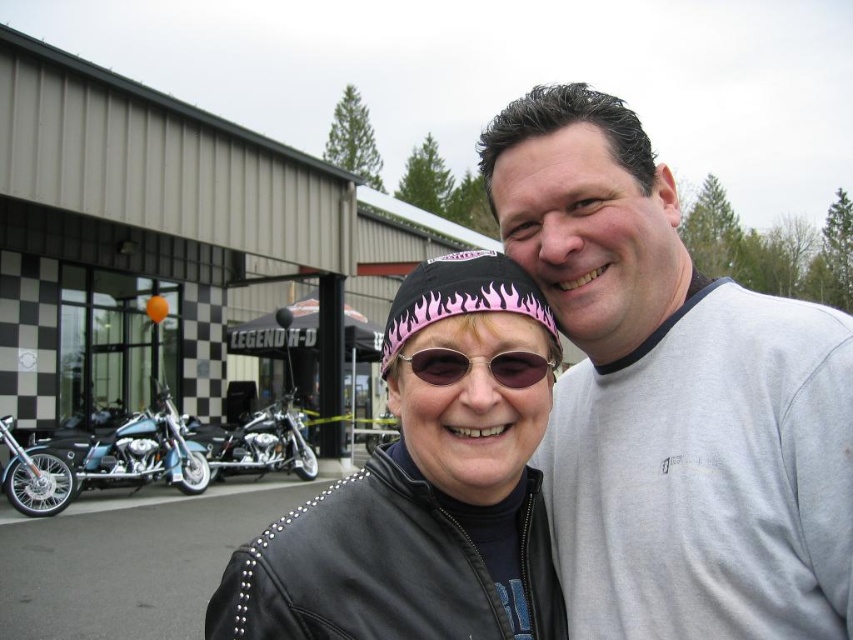
Question: Does black leather jacket at center have a smaller size compared to teal metallic motorcycle at left?

Choices:
 (A) yes
 (B) no

Answer: (A)

Question: Which point is farther to the camera?

Choices:
 (A) teal metallic motorcycle at left
 (B) gray cotton t-shirt at upper right
 (C) pink fabric headscarf at center

Answer: (A)

Question: Can you confirm if black leather jacket at center is positioned to the left of polished chrome wheel at lower left?

Choices:
 (A) no
 (B) yes

Answer: (A)

Question: Which is farther from the gray cotton t-shirt at upper right?

Choices:
 (A) sunglasses at center
 (B) teal metallic motorcycle at left
 (C) chrome metallic motorcycle at center
 (D) pink fabric headscarf at center

Answer: (C)

Question: Which point is farther from the camera taking this photo?

Choices:
 (A) (497, 458)
 (B) (227, 428)
 (C) (125, 445)

Answer: (B)

Question: Is pink fabric headscarf at center behind teal metallic motorcycle at left?

Choices:
 (A) no
 (B) yes

Answer: (A)